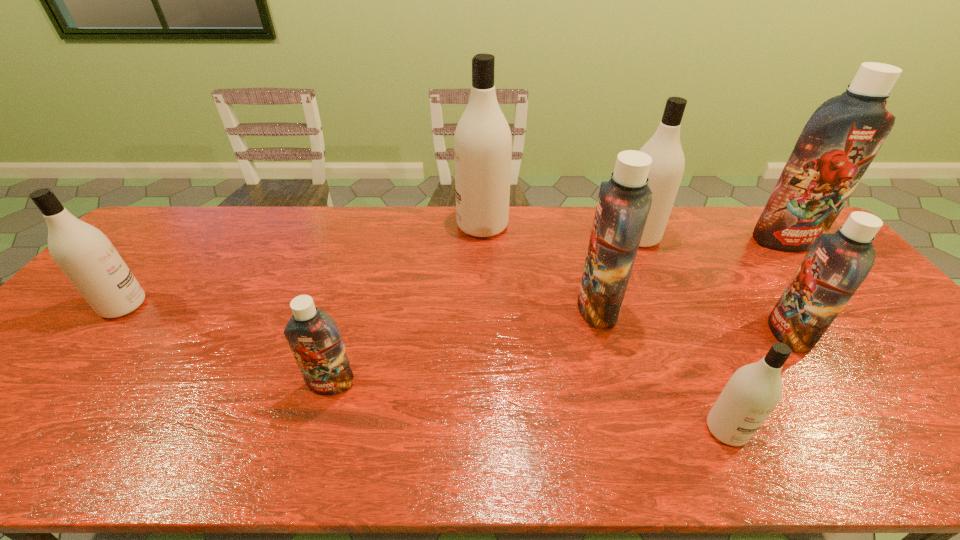
Locate an element on the screen. The width and height of the screenshot is (960, 540). vacant space that's between the seventh shampoo from left to right and the biggest white shampoo is located at coordinates (636, 279).

Locate an element on the screen. This screenshot has width=960, height=540. free space between the second shampoo from right to left and the second nearest shampoo is located at coordinates (560, 359).

You are a GUI agent. You are given a task and a screenshot of the screen. Output one action in this format:
    pyautogui.click(x=<x>, y=<y>)
    Task: Click on the vacant point located between the biggest blue shampoo and the nearest shampoo
    This screenshot has width=960, height=540.
    Given the screenshot: What is the action you would take?
    pyautogui.click(x=756, y=335)

Locate an element on the screen. This screenshot has width=960, height=540. free spot between the third object from left to right and the seventh shampoo from right to left is located at coordinates (407, 305).

Image resolution: width=960 pixels, height=540 pixels. Identify the location of empty space that is in between the rightmost blue shampoo and the third smallest blue shampoo. (691, 274).

Image resolution: width=960 pixels, height=540 pixels. What are the coordinates of `the sixth closest object to the second biggest white shampoo` in the screenshot? It's located at (315, 340).

Where is `the closest object to the nearest blue shampoo`? The image size is (960, 540). the closest object to the nearest blue shampoo is located at coordinates (87, 257).

Where is `shampoo that stands as the third closest to the second biggest white shampoo`? The image size is (960, 540). shampoo that stands as the third closest to the second biggest white shampoo is located at coordinates (836, 265).

Where is `shampoo identified as the second closest to the second blue shampoo from right to left`? The height and width of the screenshot is (540, 960). shampoo identified as the second closest to the second blue shampoo from right to left is located at coordinates (842, 137).

Identify the location of the third closest white shampoo relative to the third shampoo from left to right. The height and width of the screenshot is (540, 960). (87, 257).